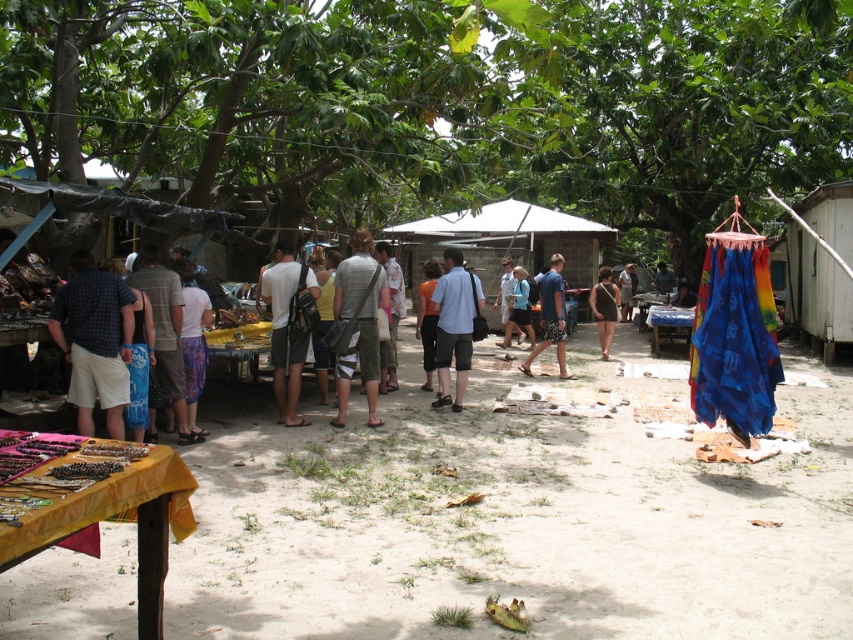
Question: Which of the following is the closest to the observer?

Choices:
 (A) blue printed shorts at center
 (B) gray fabric bag at center
 (C) plaid shirt at left

Answer: (C)

Question: Which point is closer to the camera?

Choices:
 (A) (462, 349)
 (B) (299, 262)

Answer: (A)

Question: Which point is farther to the camera?

Choices:
 (A) (271, 346)
 (B) (601, 316)
 (C) (363, 234)
 (D) (109, 360)

Answer: (B)

Question: Is plaid shirt at left below light blue fabric at center?

Choices:
 (A) yes
 (B) no

Answer: (A)

Question: Can you confirm if gray fabric bag at center is wider than blue printed shorts at center?

Choices:
 (A) yes
 (B) no

Answer: (B)

Question: Is blue printed shorts at center closer to the viewer compared to black fabric dress at center?

Choices:
 (A) no
 (B) yes

Answer: (B)